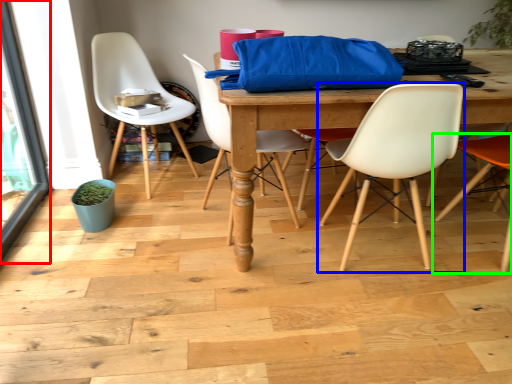
Question: Considering the real-world distances, which object is farthest from screen door (highlighted by a red box)? chair (highlighted by a blue box) or chair (highlighted by a green box)?

Choices:
 (A) chair
 (B) chair

Answer: (B)